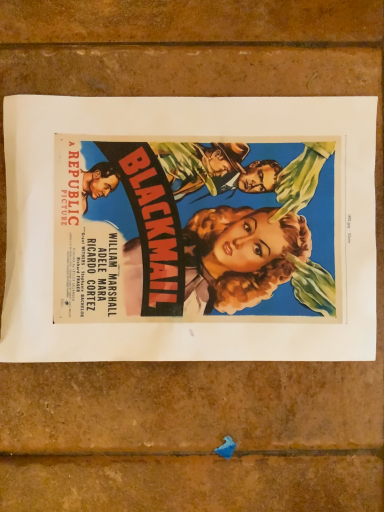
Find the location of `free space above vibrant paper poster at center (from a real-world perspective)`. free space above vibrant paper poster at center (from a real-world perspective) is located at coordinates (200, 221).